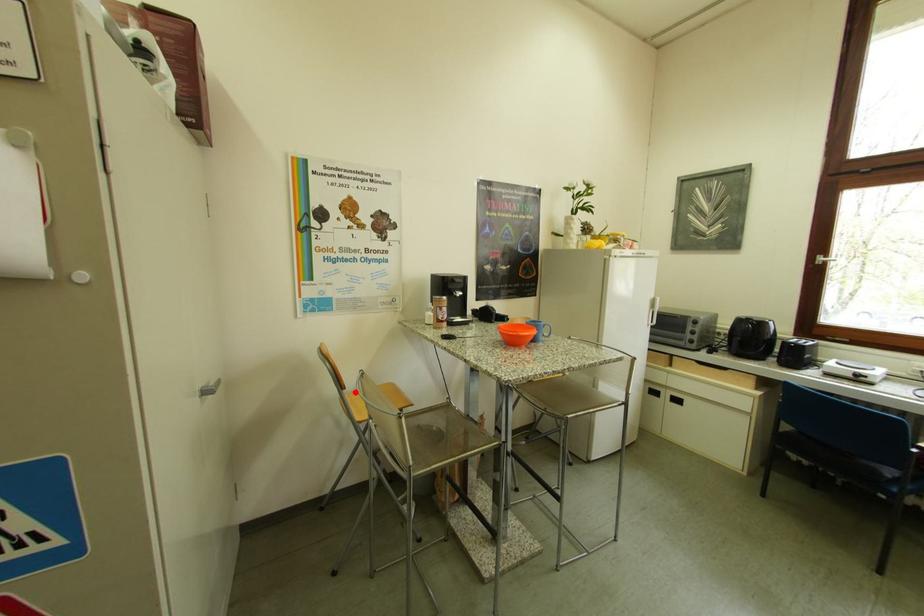
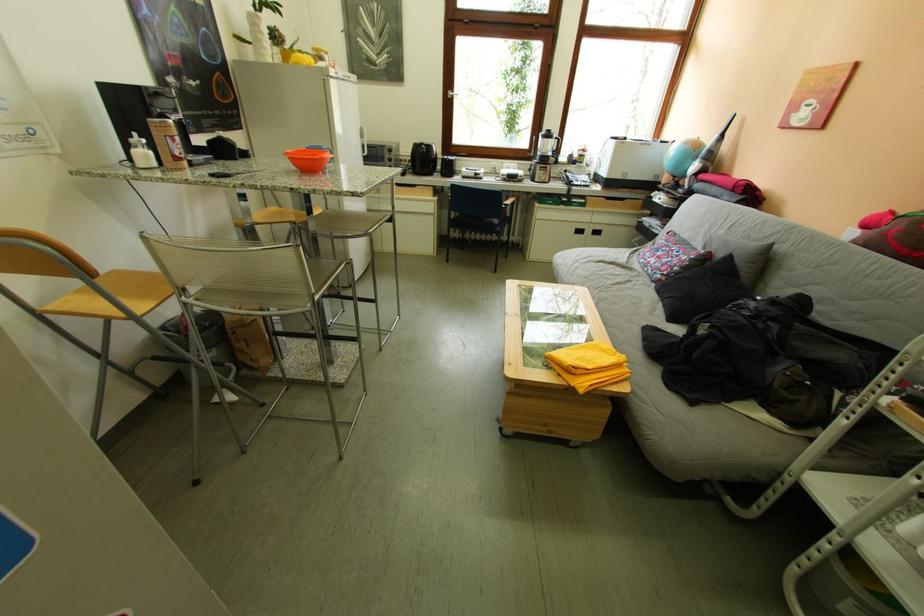
Question: A red point is marked in image1. In image2, is the corresponding 3D point closer to the camera or farther? Reply with the corresponding letter.

Choices:
 (A) The corresponding 3D point is closer.
 (B) The corresponding 3D point is farther.

Answer: (A)